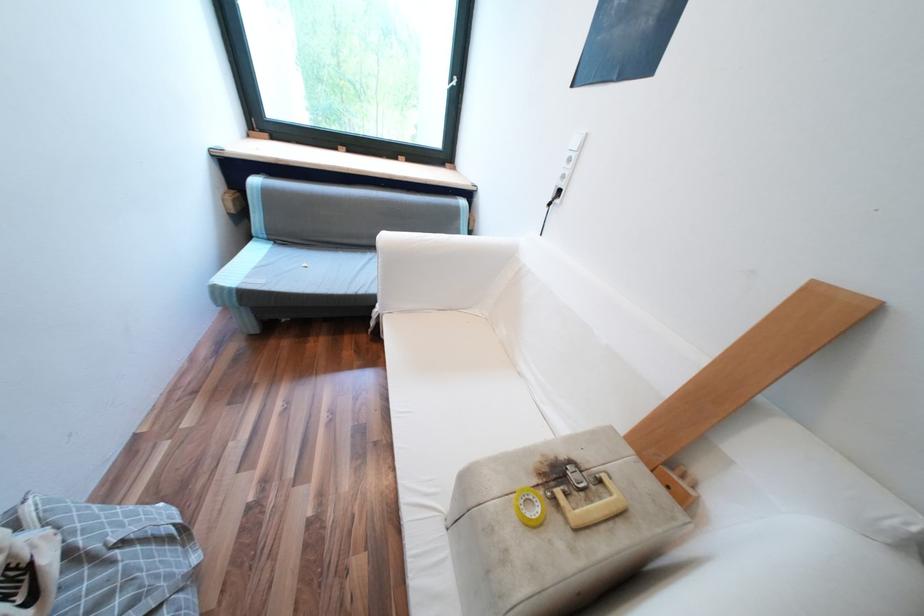
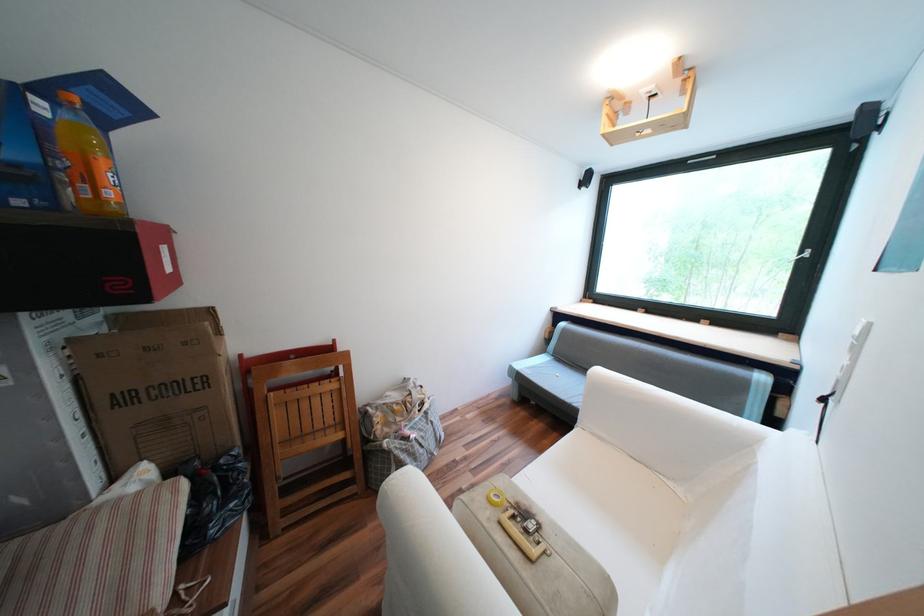
Question: I am providing you with two images of the same scene from different viewpoints. Please identify which objects are invisible in image2.

Choices:
 (A) white sofa armrest
 (B) patterned tote bag
 (C) yellow tape roll
 (D) none of these

Answer: (D)